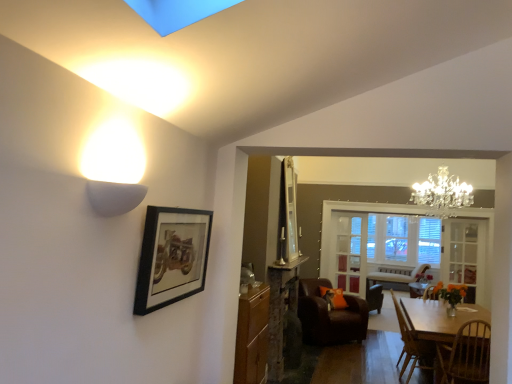
This screenshot has width=512, height=384. What do you see at coordinates (172, 257) in the screenshot?
I see `black matte picture frame at upper center` at bounding box center [172, 257].

Find the location of a particular element. The height and width of the screenshot is (384, 512). wooden cabinet at center is located at coordinates (252, 336).

What is the approximate width of brown leather armchair at center, the 1th chair positioned from the back?

brown leather armchair at center, the 1th chair positioned from the back, is 35.70 inches wide.

Image resolution: width=512 pixels, height=384 pixels. Describe the element at coordinates (330, 315) in the screenshot. I see `brown leather armchair at center, which is the third chair in front-to-back order` at that location.

What do you see at coordinates (439, 318) in the screenshot? The width and height of the screenshot is (512, 384). I see `wooden dining table at lower right` at bounding box center [439, 318].

Find the location of a particular element. The width and height of the screenshot is (512, 384). clear glass door at center, which ranks as the 2th glass door in back-to-front order is located at coordinates (463, 254).

From a real-world perspective, between clear glass door at center, acting as the first glass door starting from the left, and brown wooden chair at lower right, the third chair in the back-to-front sequence, who is vertically higher?

In real-world perspective, clear glass door at center, acting as the first glass door starting from the left, is above.

From the picture: Can you confirm if clear glass door at center, marked as the second glass door in a front-to-back arrangement, is positioned to the left of brown wooden chair at lower right, the third chair in the back-to-front sequence?

Indeed, clear glass door at center, marked as the second glass door in a front-to-back arrangement, is positioned on the left side of brown wooden chair at lower right, the third chair in the back-to-front sequence.

Which is in front, point (333, 232) or point (440, 350)?

The point (440, 350) is closer.

Considering the sizes of objects clear glass door at center, acting as the first glass door starting from the left, and brown wooden chair at lower right, the 1th chair from the front, in the image provided, who is smaller, clear glass door at center, acting as the first glass door starting from the left, or brown wooden chair at lower right, the 1th chair from the front,?

clear glass door at center, acting as the first glass door starting from the left, is smaller.

From a real-world perspective, which is physically above, wooden dining table at lower right or wooden cabinet at center?

wooden cabinet at center is physically above.

Which is more to the left, wooden dining table at lower right or wooden cabinet at center?

wooden cabinet at center.

Considering the relative positions of wooden dining table at lower right and wooden cabinet at center in the image provided, is wooden dining table at lower right in front of wooden cabinet at center?

No.

Does wooden dining table at lower right contain wooden cabinet at center?

No, wooden cabinet at center is not a part of wooden dining table at lower right.

Is clear glass window at center outside of brown leather armchair at center, which is the third chair in front-to-back order?

Yes, clear glass window at center is located beyond the bounds of brown leather armchair at center, which is the third chair in front-to-back order.

Considering the relative positions of clear glass window at center and brown leather armchair at center, the 1th chair positioned from the back, in the image provided, is clear glass window at center to the left of brown leather armchair at center, the 1th chair positioned from the back, from the viewer's perspective?

Incorrect, clear glass window at center is not on the left side of brown leather armchair at center, the 1th chair positioned from the back.

From the image's perspective, between clear glass window at center and brown leather armchair at center, which is the third chair in front-to-back order, who is located below?

brown leather armchair at center, which is the third chair in front-to-back order.

Which is more distant, (344, 268) or (353, 328)?

The point (344, 268) is behind.

Is there a large distance between wooden chair at lower right, the second chair in the back-to-front sequence, and clear glass door at center, the 2th glass door in the left-to-right sequence?

wooden chair at lower right, the second chair in the back-to-front sequence, is far away from clear glass door at center, the 2th glass door in the left-to-right sequence.

Image resolution: width=512 pixels, height=384 pixels. I want to click on glass door that is on the right side of wooden chair at lower right, which ranks as the 2th chair in front-to-back order, so click(463, 254).

Is wooden chair at lower right, the second chair in the back-to-front sequence, in front of or behind clear glass door at center, acting as the first glass door starting from the right, in the image?

Clearly, wooden chair at lower right, the second chair in the back-to-front sequence, is in front of clear glass door at center, acting as the first glass door starting from the right.

Is brown leather armchair at center, the 1th chair positioned from the back, to the left of wooden chair at lower right, the second chair in the back-to-front sequence, from the viewer's perspective?

Yes, brown leather armchair at center, the 1th chair positioned from the back, is to the left of wooden chair at lower right, the second chair in the back-to-front sequence.

Looking at this image, is brown leather armchair at center, the 1th chair positioned from the back, placed right next to wooden chair at lower right, which ranks as the 2th chair in front-to-back order?

There is a gap between brown leather armchair at center, the 1th chair positioned from the back, and wooden chair at lower right, which ranks as the 2th chair in front-to-back order.

Could you tell me if brown leather armchair at center, which is the third chair in front-to-back order, is facing wooden chair at lower right, which ranks as the 2th chair in front-to-back order?

Yes, brown leather armchair at center, which is the third chair in front-to-back order, is aimed at wooden chair at lower right, which ranks as the 2th chair in front-to-back order.

From a real-world perspective, which is physically above, brown leather armchair at center, the 1th chair positioned from the back, or wooden chair at lower right, which ranks as the 2th chair in front-to-back order?

wooden chair at lower right, which ranks as the 2th chair in front-to-back order, from a real-world perspective.

Considering the positions of objects brown wooden chair at lower right, the third chair in the back-to-front sequence, and clear glass door at center, the 2th glass door in the left-to-right sequence, in the image provided, who is more to the right, brown wooden chair at lower right, the third chair in the back-to-front sequence, or clear glass door at center, the 2th glass door in the left-to-right sequence,?

Positioned to the right is clear glass door at center, the 2th glass door in the left-to-right sequence.

From the image's perspective, which is above, brown wooden chair at lower right, the 1th chair from the front, or clear glass door at center, acting as the first glass door starting from the right?

clear glass door at center, acting as the first glass door starting from the right, from the image's perspective.

Considering the relative sizes of brown wooden chair at lower right, the 1th chair from the front, and clear glass door at center, which ranks as the 2th glass door in back-to-front order, in the image provided, is brown wooden chair at lower right, the 1th chair from the front, bigger than clear glass door at center, which ranks as the 2th glass door in back-to-front order,?

Correct, brown wooden chair at lower right, the 1th chair from the front, is larger in size than clear glass door at center, which ranks as the 2th glass door in back-to-front order.

From the image's perspective, which one is positioned higher, wooden chair at lower right, the second chair in the back-to-front sequence, or wooden cabinet at center?

wooden cabinet at center is shown above in the image.

In the image, is wooden chair at lower right, which ranks as the 2th chair in front-to-back order, positioned in front of or behind wooden cabinet at center?

In the image, wooden chair at lower right, which ranks as the 2th chair in front-to-back order, appears behind wooden cabinet at center.

Where is `the 2nd chair directly beneath the wooden cabinet at center (from a real-world perspective)`? This screenshot has height=384, width=512. the 2nd chair directly beneath the wooden cabinet at center (from a real-world perspective) is located at coordinates (412, 345).

From a real-world perspective, which object rests below the other?

wooden chair at lower right, the second chair in the back-to-front sequence, is physically lower.

Which chair is the 3rd one when counting from the front of the clear glass door at center, the second glass door positioned from the right? Please provide its 2D coordinates.

[(466, 355)]

You are a GUI agent. You are given a task and a screenshot of the screen. Output one action in this format:
    pyautogui.click(x=<x>, y=<y>)
    Task: Click on the table on the right of wooden cabinet at center
    This screenshot has height=384, width=512.
    Given the screenshot: What is the action you would take?
    pyautogui.click(x=439, y=318)

Looking at the image, which one is located closer to wooden chair at lower right, the second chair in the back-to-front sequence, wooden dining table at lower right or black matte picture frame at upper center?

wooden dining table at lower right is closer to wooden chair at lower right, the second chair in the back-to-front sequence.

Considering their positions, is clear glass door at center, the 2th glass door in the left-to-right sequence, positioned further to clear glass door at center, marked as the second glass door in a front-to-back arrangement, than wooden dining table at lower right?

Based on the image, wooden dining table at lower right appears to be further to clear glass door at center, marked as the second glass door in a front-to-back arrangement.

Estimate the real-world distances between objects in this image. Which object is further from brown wooden chair at lower right, the third chair in the back-to-front sequence, wooden cabinet at center or wooden chair at lower right, the second chair in the back-to-front sequence?

The object further to brown wooden chair at lower right, the third chair in the back-to-front sequence, is wooden cabinet at center.

Estimate the real-world distances between objects in this image. Which object is closer to brown wooden chair at lower right, the 1th chair from the front, clear glass door at center, which is the 1th glass door from back to front, or wooden chair at lower right, the second chair in the back-to-front sequence?

wooden chair at lower right, the second chair in the back-to-front sequence, lies closer to brown wooden chair at lower right, the 1th chair from the front, than the other object.

Estimate the real-world distances between objects in this image. Which object is closer to brown wooden chair at lower right, the 1th chair from the front, clear glass window at center or wooden cabinet at center?

wooden cabinet at center is closer to brown wooden chair at lower right, the 1th chair from the front.

Based on the photo, estimate the real-world distances between objects in this image. Which object is closer to brown leather armchair at center, which is the third chair in front-to-back order, clear glass door at center, the 2th glass door in the left-to-right sequence, or black matte picture frame at upper center?

The object closer to brown leather armchair at center, which is the third chair in front-to-back order, is clear glass door at center, the 2th glass door in the left-to-right sequence.

Estimate the real-world distances between objects in this image. Which object is further from wooden dining table at lower right, wooden chair at lower right, the second chair in the back-to-front sequence, or brown leather armchair at center, which is the third chair in front-to-back order?

brown leather armchair at center, which is the third chair in front-to-back order, is further to wooden dining table at lower right.

When comparing their distances from wooden chair at lower right, the second chair in the back-to-front sequence, does wooden cabinet at center or clear glass window at center seem closer?

clear glass window at center lies closer to wooden chair at lower right, the second chair in the back-to-front sequence, than the other object.

Locate an element on the screen. glass door between brown leather armchair at center, which is the third chair in front-to-back order, and clear glass door at center, which ranks as the 2th glass door in back-to-front order, from left to right is located at coordinates (349, 252).

Image resolution: width=512 pixels, height=384 pixels. I want to click on glass door between brown wooden chair at lower right, the 1th chair from the front, and clear glass door at center, the second glass door positioned from the right, along the z-axis, so click(463, 254).

The image size is (512, 384). Find the location of `table between black matte picture frame at upper center and clear glass door at center, the second glass door positioned from the right, in the front-back direction`. table between black matte picture frame at upper center and clear glass door at center, the second glass door positioned from the right, in the front-back direction is located at coordinates (439, 318).

Find the location of `window between clear glass door at center, the second glass door positioned from the right, and clear glass door at center, which is counted as the 1th glass door, starting from the front`. window between clear glass door at center, the second glass door positioned from the right, and clear glass door at center, which is counted as the 1th glass door, starting from the front is located at coordinates (405, 245).